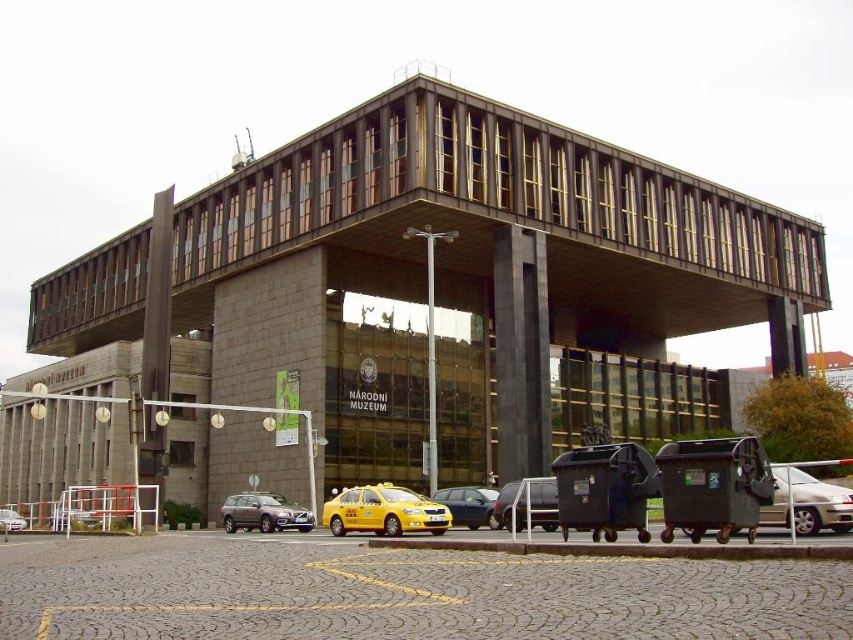
Question: Does matte gray suv at center appear over metallic silver car at lower center?

Choices:
 (A) yes
 (B) no

Answer: (B)

Question: Among these objects, which one is farthest from the camera?

Choices:
 (A) silver metallic sedan at lower right
 (B) silver metallic sedan at lower left

Answer: (B)

Question: Among these objects, which one is farthest from the camera?

Choices:
 (A) metallic yellow taxi at center
 (B) yellow matte taxi at lower center

Answer: (A)

Question: Is metallic silver car at lower center to the right of metallic yellow taxi at center from the viewer's perspective?

Choices:
 (A) no
 (B) yes

Answer: (B)

Question: Which point is farther to the camera?

Choices:
 (A) yellow matte taxi at lower center
 (B) metallic silver car at lower center

Answer: (A)

Question: Is yellow matte taxi at lower center closer to camera compared to metallic yellow taxi at center?

Choices:
 (A) no
 (B) yes

Answer: (B)